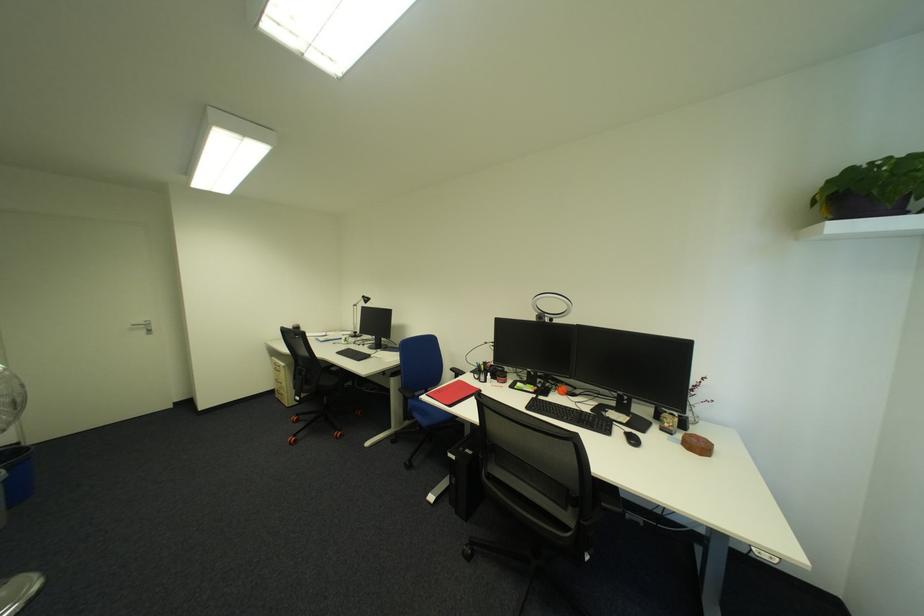
Describe the element at coordinates (426, 411) in the screenshot. The height and width of the screenshot is (616, 924). I see `a chair sitting surface` at that location.